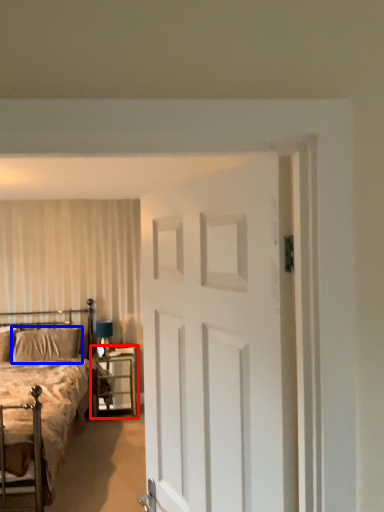
Question: Which object is further to the camera taking this photo, nightstand (highlighted by a red box) or pillow (highlighted by a blue box)?

Choices:
 (A) nightstand
 (B) pillow

Answer: (B)